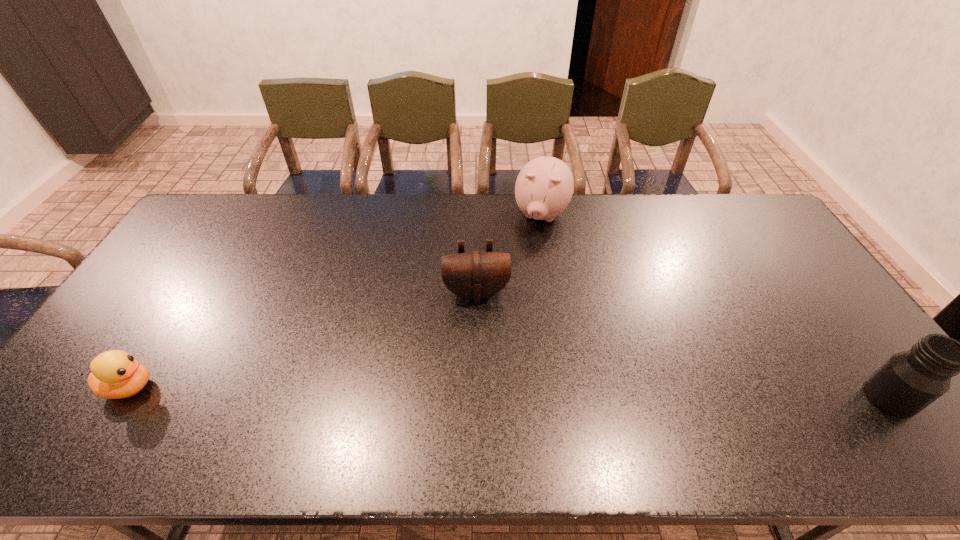
You are a GUI agent. You are given a task and a screenshot of the screen. Output one action in this format:
    pyautogui.click(x=<x>, y=<y>)
    Task: Click on the shortest object
    This screenshot has width=960, height=540.
    Given the screenshot: What is the action you would take?
    pyautogui.click(x=115, y=374)

Find the location of a particular element. duckling is located at coordinates (115, 374).

Identify the location of the rightmost object. (908, 382).

The height and width of the screenshot is (540, 960). Identify the location of piggy bank. (544, 187).

You are a GUI agent. You are given a task and a screenshot of the screen. Output one action in this format:
    pyautogui.click(x=<x>, y=<y>)
    Task: Click on the farthest object
    The width and height of the screenshot is (960, 540).
    Given the screenshot: What is the action you would take?
    [x=544, y=187]

You are a GUI agent. You are given a task and a screenshot of the screen. Output one action in this format:
    pyautogui.click(x=<x>, y=<y>)
    Task: Click on the second farthest object
    The image size is (960, 540).
    Given the screenshot: What is the action you would take?
    pyautogui.click(x=475, y=275)

At what (x,y) coordinates should I click in order to perform the action: click on pouch. Please return your answer as a coordinate pair (x, y). Looking at the image, I should click on (475, 275).

Locate an element on the screen. vacant space located on the face of the duckling is located at coordinates (303, 387).

I want to click on vacant space located 0.220m at the snout of the second object from right to left, so click(521, 281).

Locate an element on the screen. The width and height of the screenshot is (960, 540). free space located 0.230m at the snout of the second object from right to left is located at coordinates (520, 283).